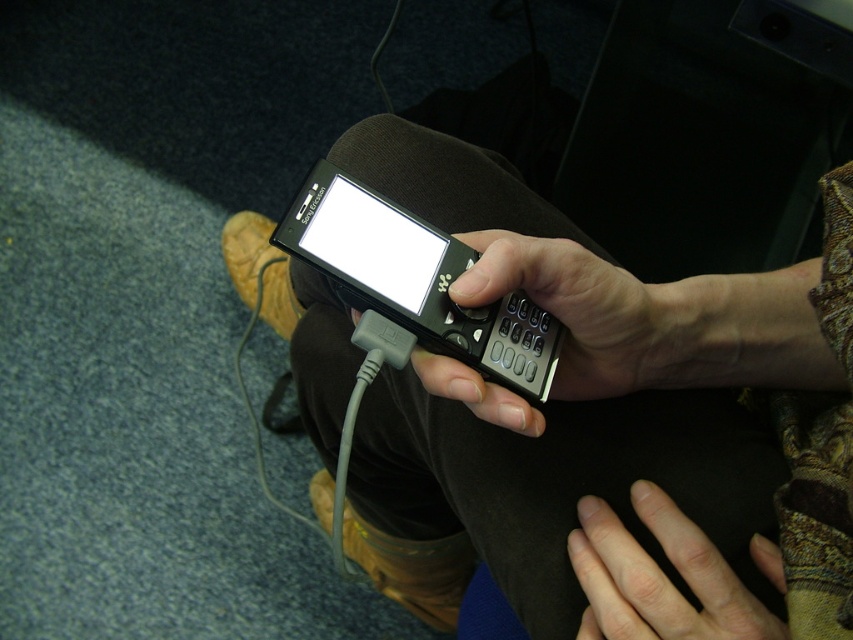
You are a photographer taking a closeup shot of a person holding a flip phone. You notice the smooth skin hand at lower center and the bright glossy screen at center. Which object is positioned to the right side of the other?

The smooth skin hand at lower center is to the right of bright glossy screen at center according to the description.

You are trying to place a protective case on the black matte phone at center and the black matte keypad at center. Based on their sizes, which one requires a larger case?

The black matte phone at center requires a larger case because it is taller than the black matte keypad at center.

You are trying to place both the black plastic smartphone at center and the black matte keypad at center into a rectangular pouch that can only hold items up to the height of the taller object. Which object determines the minimum required height of the pouch?

The black plastic smartphone at center is much taller than the black matte keypad at center, so the minimum required height of the pouch must be at least the height of the black plastic smartphone at center to accommodate both items.